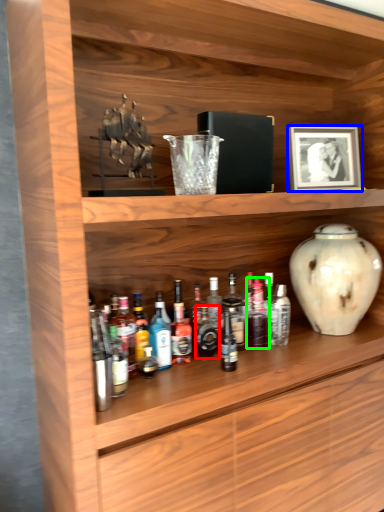
Question: Estimate the real-world distances between objects in this image. Which object is farther from bottle (highlighted by a red box), picture frame (highlighted by a blue box) or bottle (highlighted by a green box)?

Choices:
 (A) picture frame
 (B) bottle

Answer: (A)